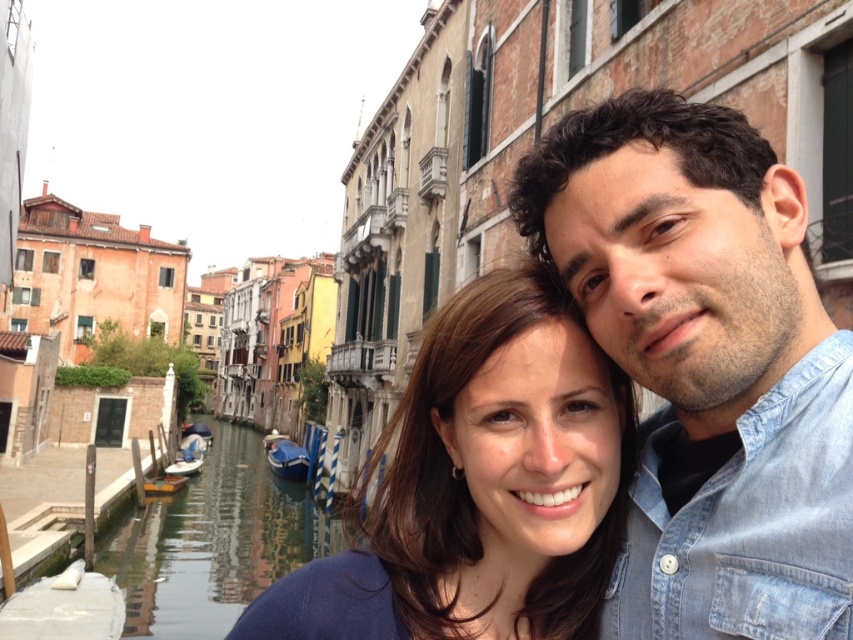
You are a photographer taking a photo of the two people in the canal scene. You need to focus on the blue denim shirt at center and the brown hair at center. Which object should you adjust your focus on first if you want to ensure both are in clear view?

The blue denim shirt at center is above brown hair at center, so you should focus on the brown hair at center first to ensure both are in clear view.

Based on the photo, you are a photographer standing at the edge of the canal. You want to take a photo of the blue denim shirt at center and the smooth water at lower left. Which object is positioned to the right of the other?

The blue denim shirt at center is to the right of smooth water at lower left.